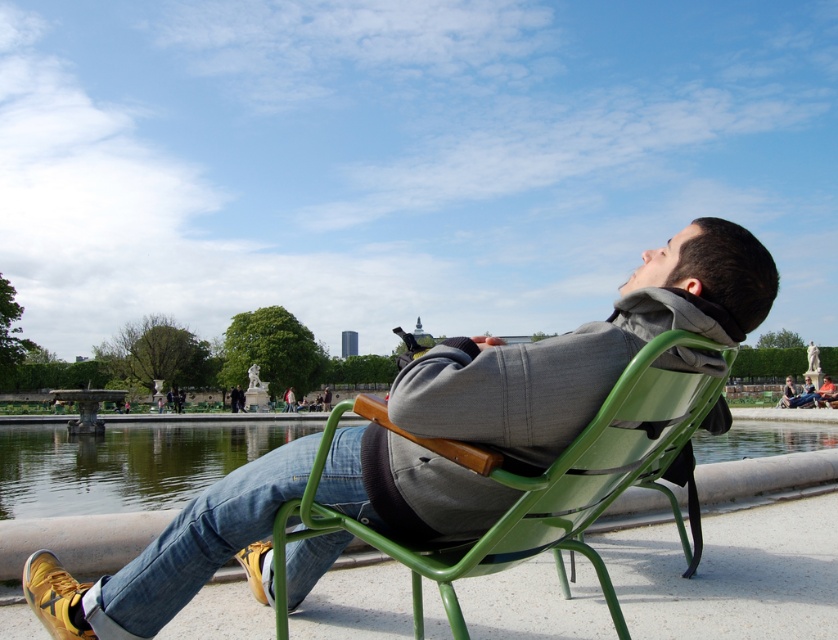
Question: Considering the real-world distances, which object is farthest from the green metal chair at center?

Choices:
 (A) clear water at chair right
 (B) matte gray jacket at center

Answer: (A)

Question: Which point appears closest to the camera in this image?

Choices:
 (A) (412, 550)
 (B) (142, 432)

Answer: (A)

Question: Can you confirm if matte gray jacket at center is positioned to the left of clear water at chair right?

Choices:
 (A) yes
 (B) no

Answer: (B)

Question: Which of the following is the farthest from the observer?

Choices:
 (A) green metal chair at center
 (B) clear water at chair right
 (C) matte gray jacket at center

Answer: (B)

Question: Can you confirm if matte gray jacket at center is thinner than green metal chair at center?

Choices:
 (A) yes
 (B) no

Answer: (B)

Question: Considering the relative positions of matte gray jacket at center and clear water at chair right in the image provided, where is matte gray jacket at center located with respect to clear water at chair right?

Choices:
 (A) below
 (B) above

Answer: (B)